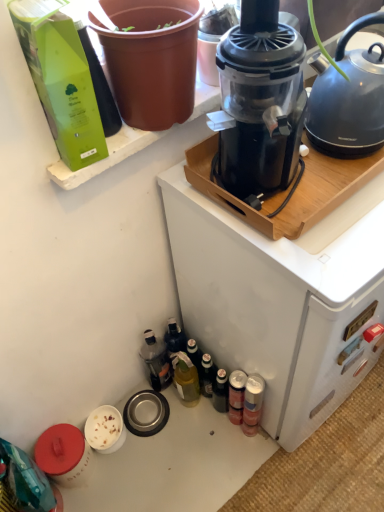
Identify the location of vacant space situated on the left part of metallic silver can at lower right, arranged as the first bottle when viewed from the right. The height and width of the screenshot is (512, 384). (202, 443).